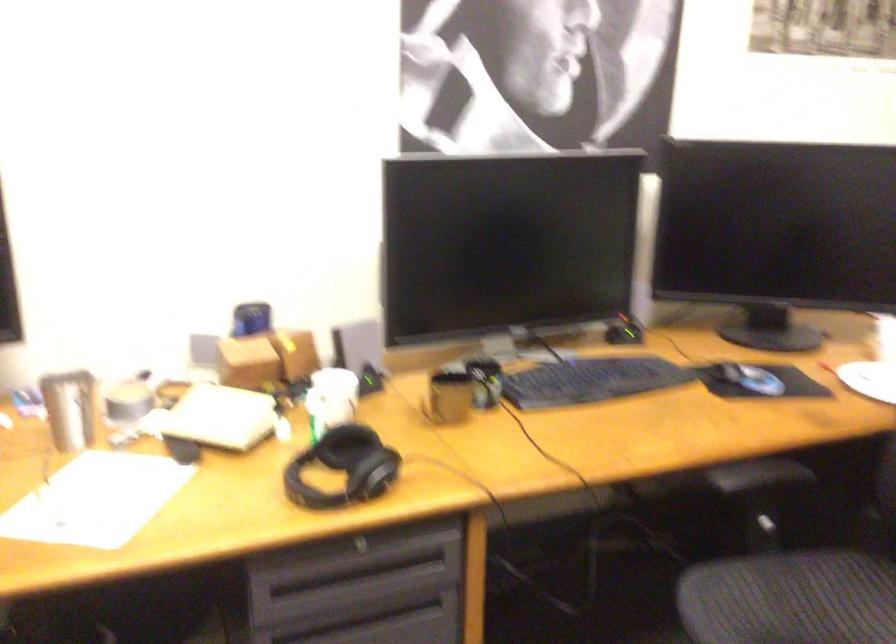
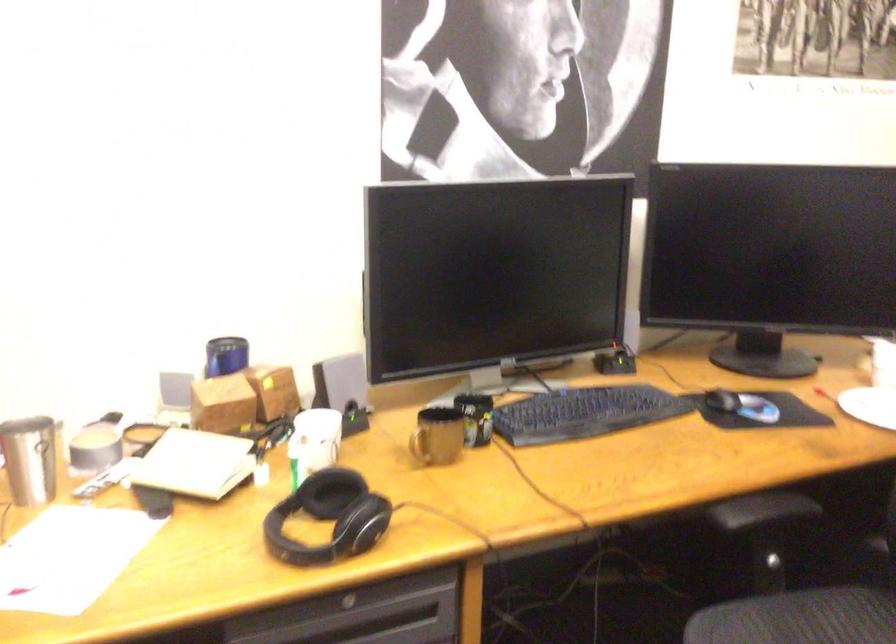
Where in the second image is the point corresponding to [428,406] from the first image?

(419, 446)